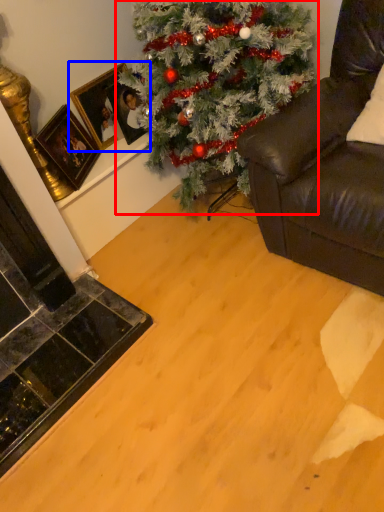
Question: Which point is further to the camera, christmas tree (highlighted by a red box) or picture frame (highlighted by a blue box)?

Choices:
 (A) christmas tree
 (B) picture frame

Answer: (B)